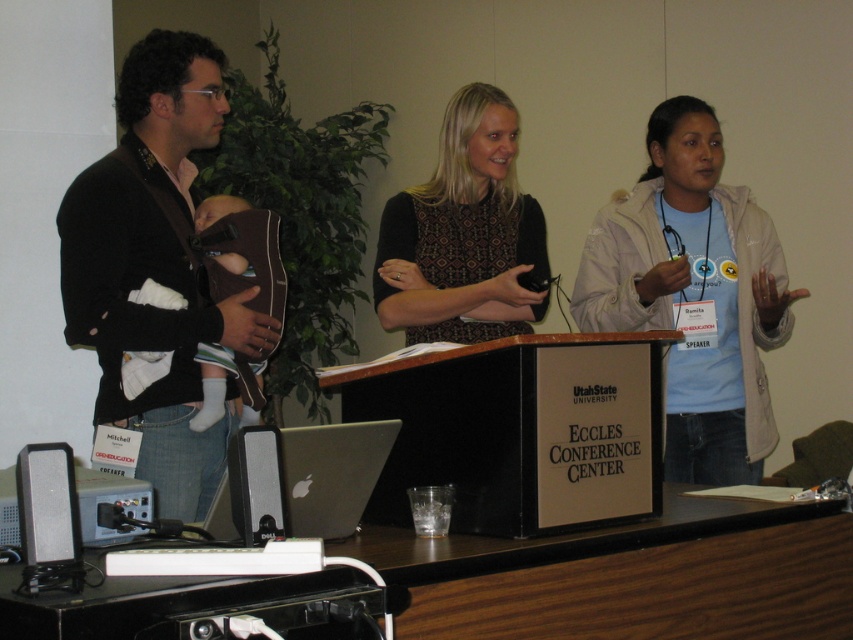
In the scene shown: You are standing in front of the desk at the Eccles Conference Center. There are two points marked on the desk. One is at coordinates point (608, 294) and the other is at point (39, 518). Which point is closer to you?

Point (608, 294) is closer to you because it is further to the viewer than point (39, 518).